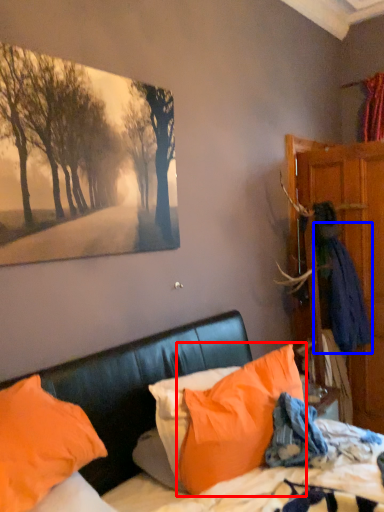
Question: Which object is further to the camera taking this photo, pillow (highlighted by a red box) or clothing (highlighted by a blue box)?

Choices:
 (A) pillow
 (B) clothing

Answer: (B)